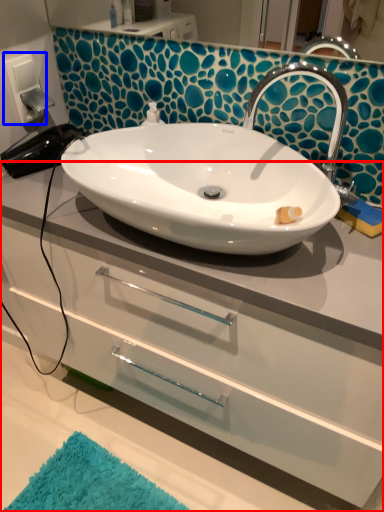
Question: Which point is further to the camera, bathroom cabinet (highlighted by a red box) or electric outlet (highlighted by a blue box)?

Choices:
 (A) bathroom cabinet
 (B) electric outlet

Answer: (B)